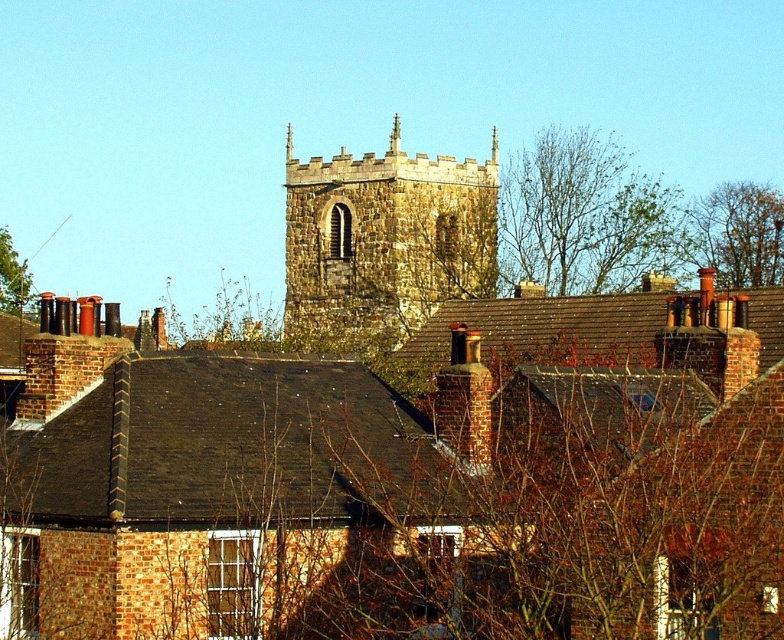
You are an architect analyzing the rooftops in the image. You notice the bare branches at upper center and the green leafy tree at upper left. Which of these elements has a greater horizontal spread across the rooftops?

The bare branches at upper center has a greater horizontal spread across the rooftops than the green leafy tree at upper left because its width surpasses the latter.

From the picture: You are standing in the town square looking at the historic stone church tower. You notice two trees in the distance. One is a bare branches at upper center and the other is a green leafy tree at upper left. Which tree appears closer to you based on their positions?

The bare branches at upper center appears closer to you because it is positioned closer to the viewer than the green leafy tree at upper left.

You are standing in the middle of the residential area looking towards the historic stone church tower. Where is the stone steeple at center located in relation to your position?

The stone steeple at center is located at the central point of the image, specifically at coordinates 0.377 on the x axis and 0.490 on the y axis.